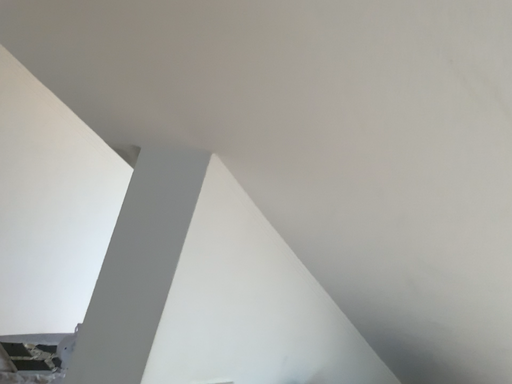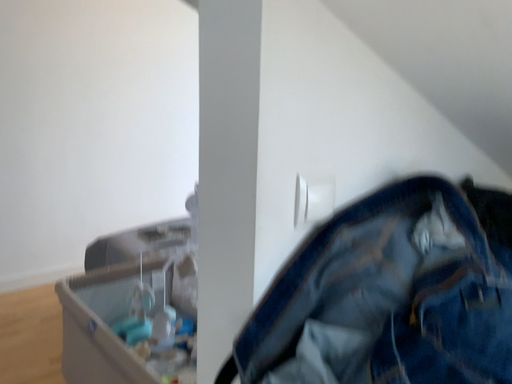
Question: How did the camera likely rotate when shooting the video?

Choices:
 (A) rotated upward
 (B) rotated downward

Answer: (B)